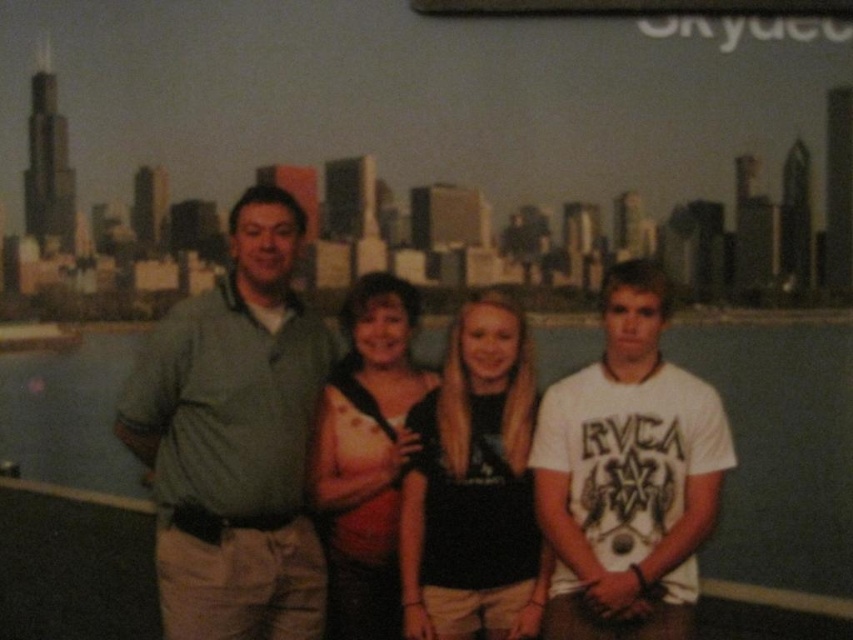
You are taking a photo of the group and want to focus on the matte green shirt at center and the black matte shirt at center. Which one should you adjust your camera focus to first to ensure both are in focus?

You should focus on the matte green shirt at center first since it is closer to the viewer than the black matte shirt at center. By focusing on the closer object, the depth of field may naturally include the farther one in acceptable focus.

You are organizing a group photo and need to arrange the matte green shirt at center and the black matte shirt at center so that both are visible. Considering their sizes, which shirt should be placed in the front to ensure both are visible?

The black matte shirt at center should be placed in the front because it is smaller in size compared to the matte green shirt at center, allowing both to be visible.

You are a photographer setting up a group shot for the four people in the scene. You need to ensure that the matte green shirt at center and the black matte shirt at center are both clearly visible in the frame. Given their sizes, which shirt might require more space to avoid being cropped out?

The matte green shirt at center has a larger width than the black matte shirt at center, so it might require more space to avoid being cropped out.